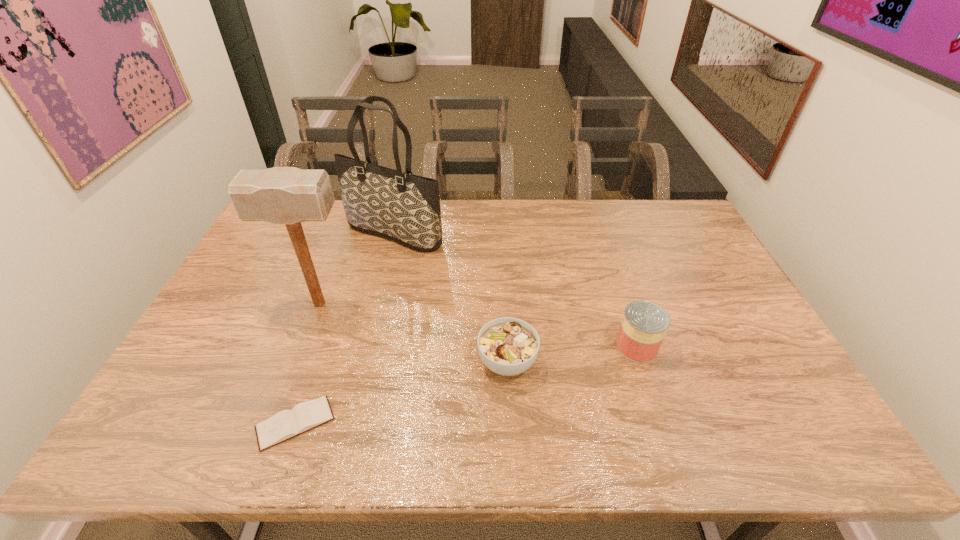
In order to click on the farthest object in this screenshot , I will do `click(399, 206)`.

In order to click on the fourth nearest object in this screenshot , I will do `click(281, 195)`.

Image resolution: width=960 pixels, height=540 pixels. In order to click on the rightmost object in this screenshot , I will do `click(644, 325)`.

Identify the location of the third shortest object. pos(644,325).

The height and width of the screenshot is (540, 960). I want to click on soup bowl, so click(508, 346).

I want to click on the second object from right to left, so click(x=508, y=346).

You are a GUI agent. You are given a task and a screenshot of the screen. Output one action in this format:
    pyautogui.click(x=<x>, y=<y>)
    Task: Click on the nearest object
    This screenshot has height=540, width=960.
    Given the screenshot: What is the action you would take?
    pyautogui.click(x=286, y=424)

I want to click on the shortest object, so click(286, 424).

This screenshot has height=540, width=960. I want to click on blank area located on the left of the tote bag, so click(324, 234).

In order to click on vacant area located 0.140m on the striking face of the second farthest object in this screenshot , I will do `click(403, 303)`.